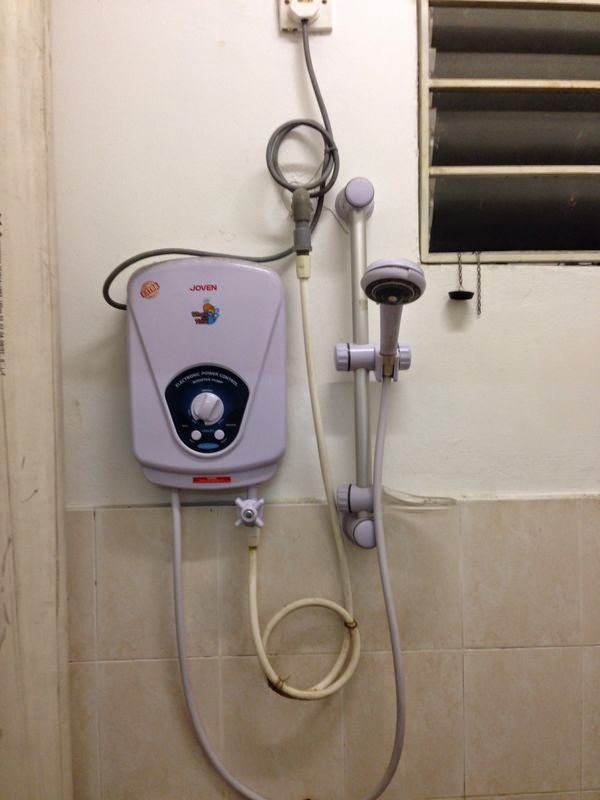
Find the location of a particular element. Image resolution: width=600 pixels, height=800 pixels. pole and device on wall is located at coordinates (392, 317), (360, 314).